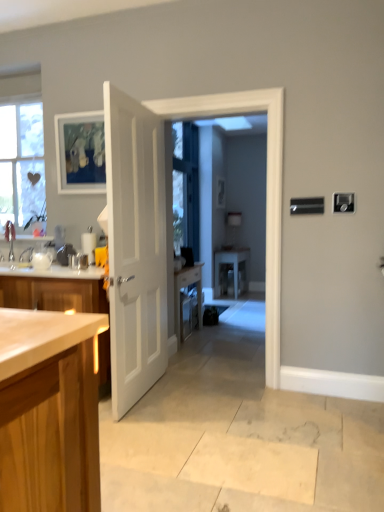
Where is `vacant space in front of white matte door at center`? The image size is (384, 512). vacant space in front of white matte door at center is located at coordinates (154, 430).